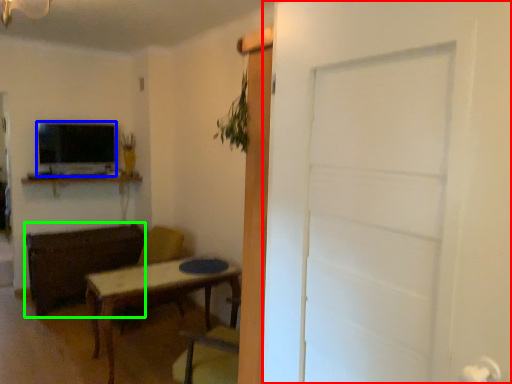
Question: Which is farther away from door (highlighted by a red box)? television (highlighted by a blue box) or brown (highlighted by a green box)?

Choices:
 (A) television
 (B) brown

Answer: (A)